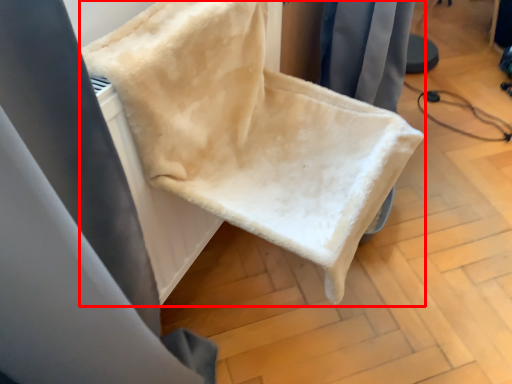
Question: Considering the relative positions of furniture (annotated by the red box) and curtain in the image provided, where is furniture (annotated by the red box) located with respect to the staircase?

Choices:
 (A) right
 (B) left

Answer: (A)